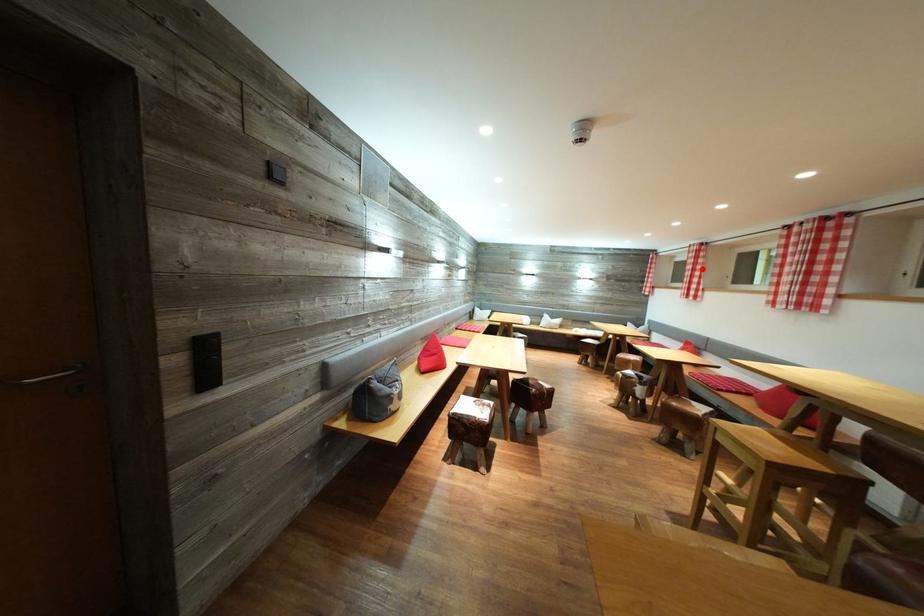
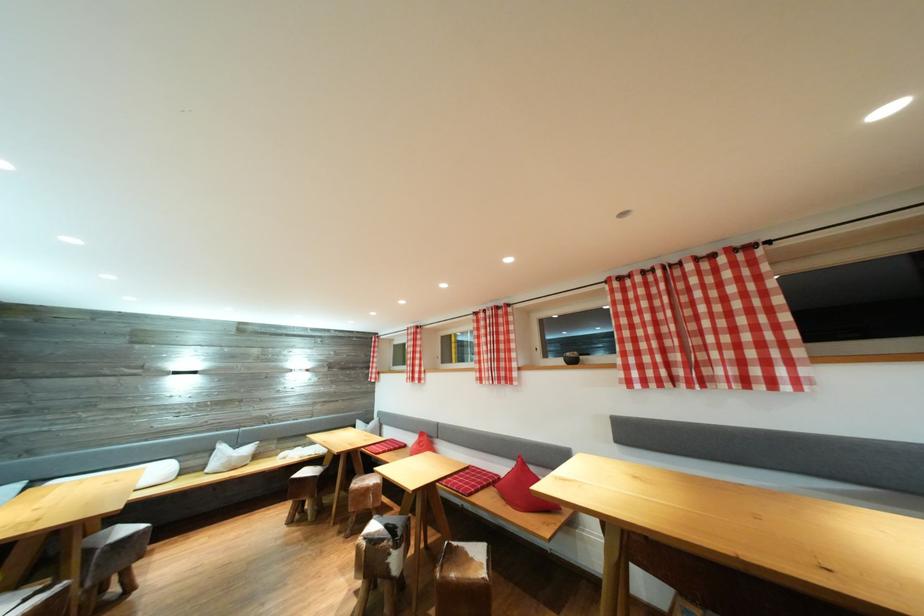
Locate, in the second image, the point that corresponds to the highlighted location in the first image.

(421, 351)